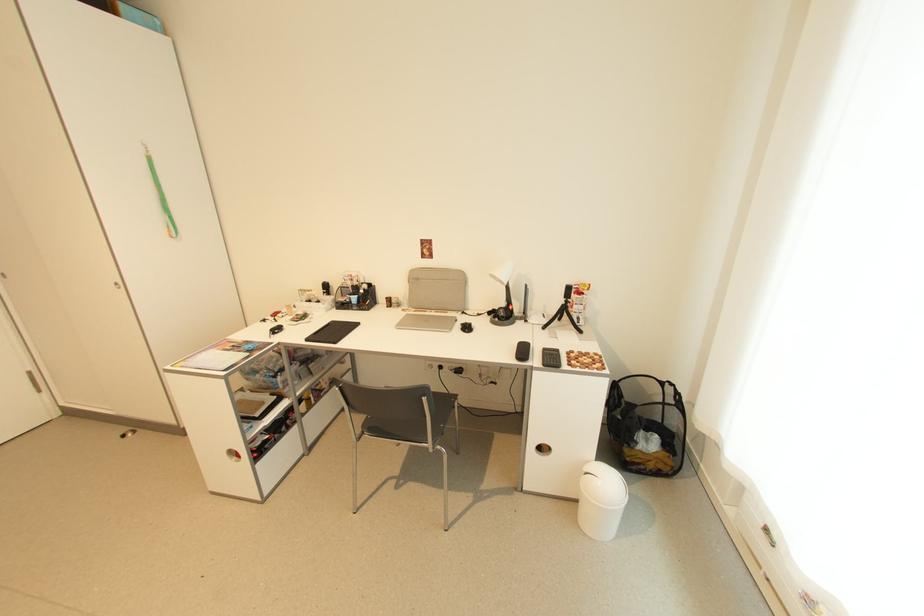
Find the location of a particular element. This screenshot has height=616, width=924. white trash can lid is located at coordinates (601, 500).